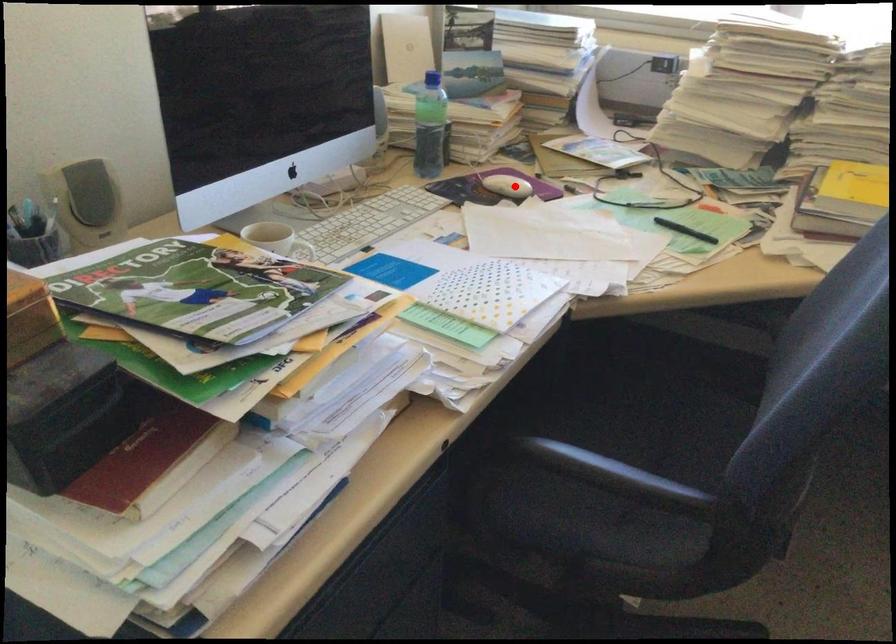
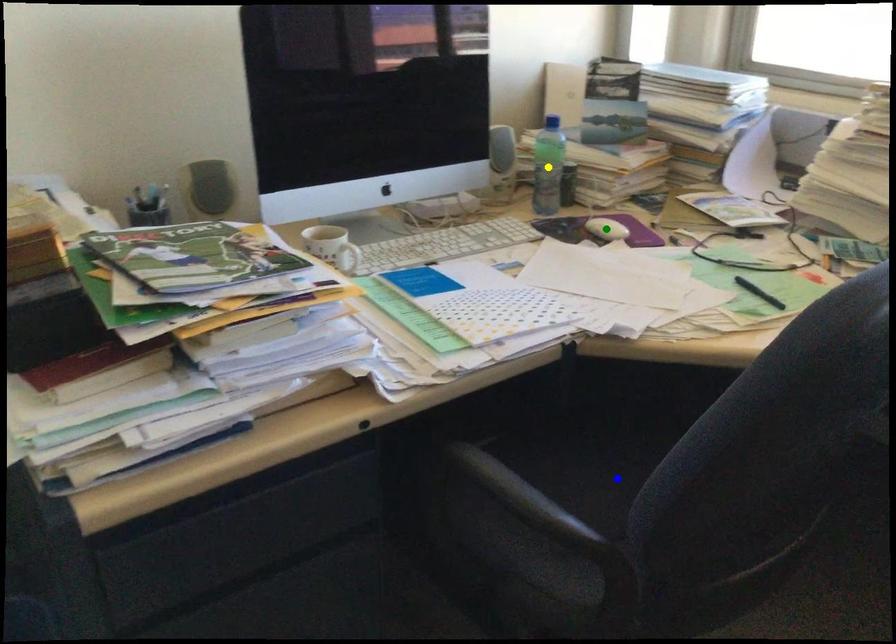
Question: I am providing you with two images of the same scene from different viewpoints. A red point is marked on the first image. You are given multiple points on the second image. Can you choose the point in image 2 that corresponds to the point in image 1?

Choices:
 (A) blue point
 (B) yellow point
 (C) green point

Answer: (C)